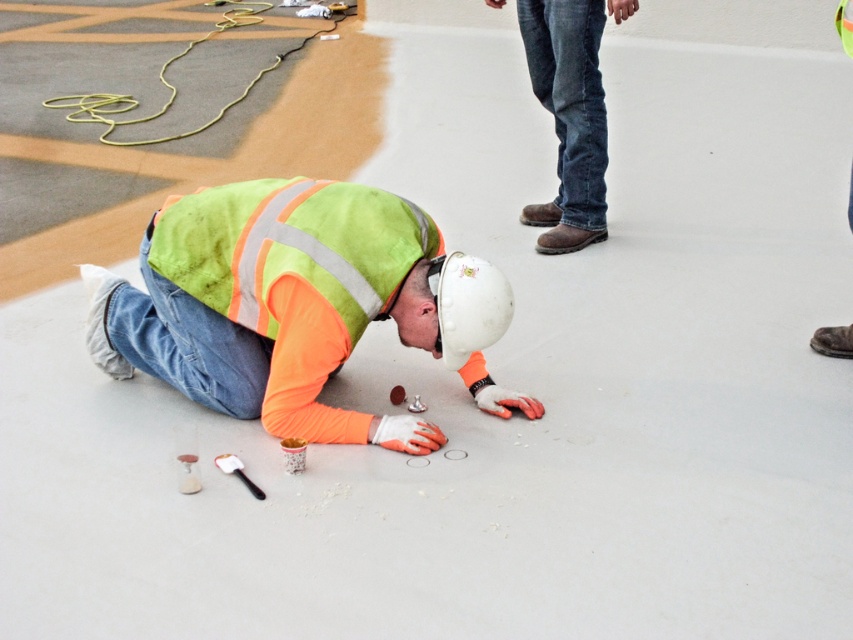
Is high visibility fabric vest at center smaller than jeans at upper right?

Actually, high visibility fabric vest at center might be larger than jeans at upper right.

Where is `high visibility fabric vest at center`? The image size is (853, 640). high visibility fabric vest at center is located at coordinates (297, 305).